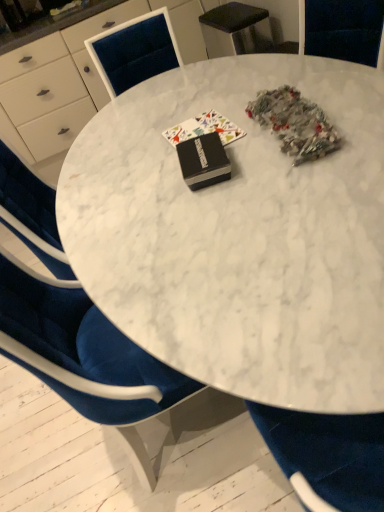
Identify the location of vacant area that lies to the right of black matte book at center, which ranks as the second book in back-to-front order. (248, 150).